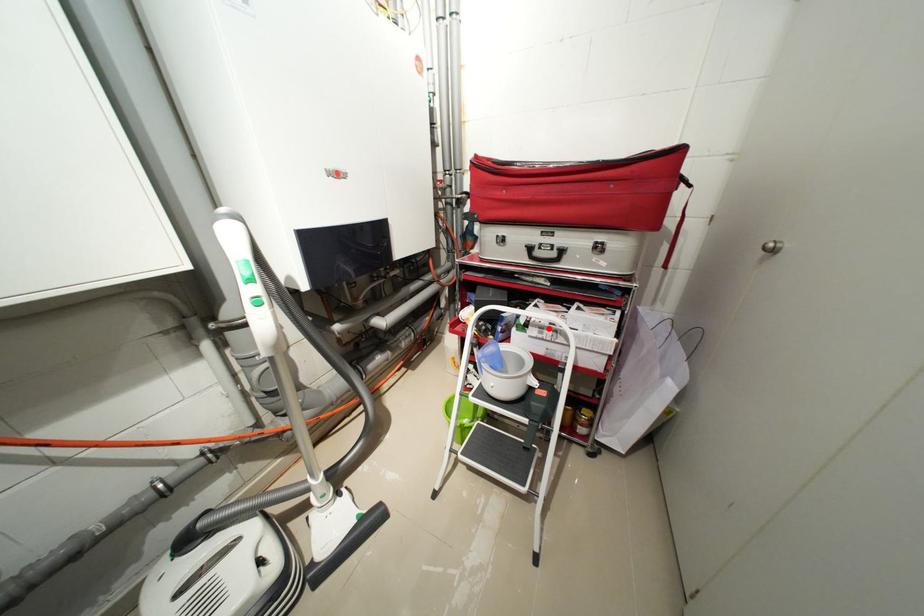
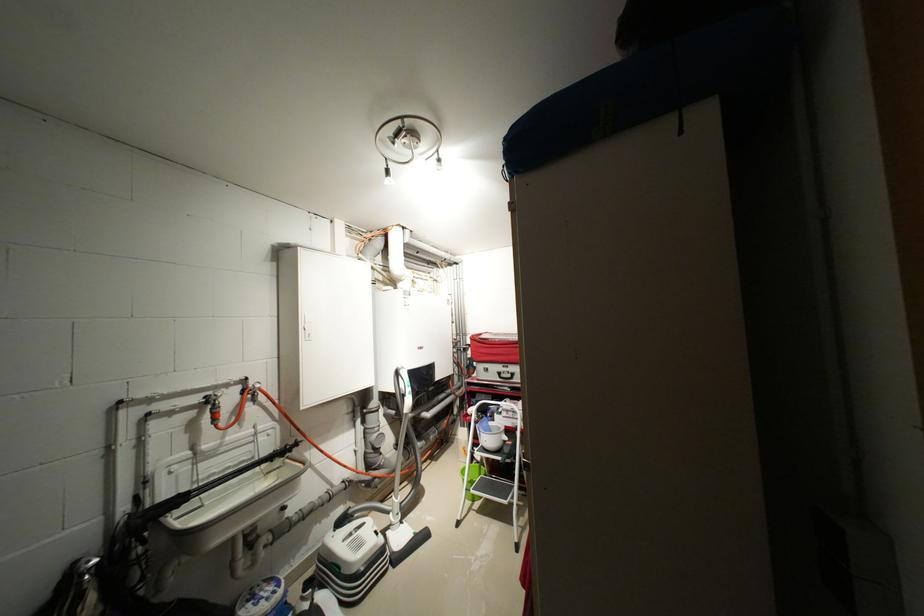
Question: I am providing you with two images of the same scene from different viewpoints. A red point is shown in image1. For the corresponding object point in image2, is it positioned nearer or farther from the camera?

Choices:
 (A) Nearer
 (B) Farther

Answer: (B)